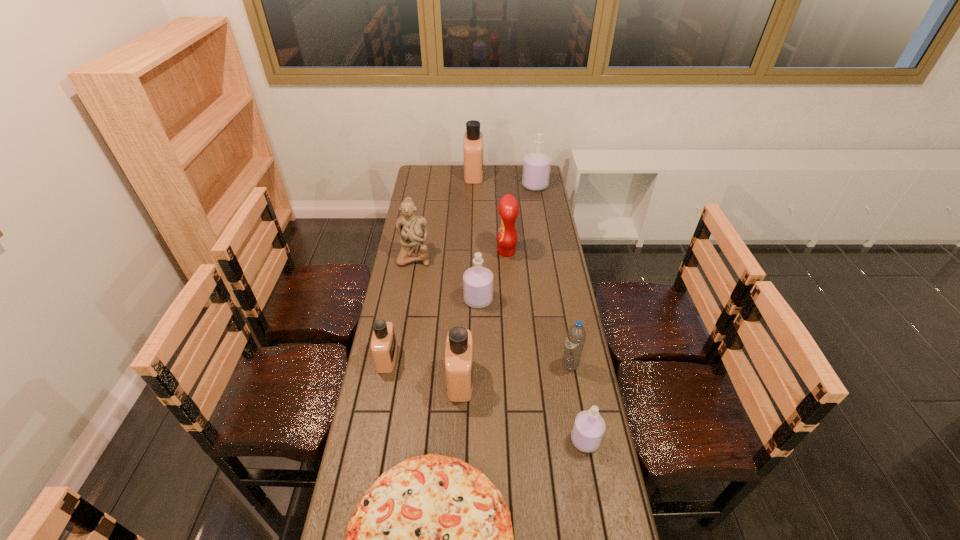
This screenshot has height=540, width=960. Identify the location of free space at the far left corner of the desktop. (420, 166).

Find the location of a particular element. This screenshot has height=540, width=960. vacant region at the far right corner of the desktop is located at coordinates (521, 184).

Locate an element on the screen. The height and width of the screenshot is (540, 960). unoccupied position between the nearest perfume and the farthest purple perfume is located at coordinates pyautogui.click(x=560, y=313).

Identify the location of free space between the water bottle and the second nearest object. This screenshot has height=540, width=960. (578, 402).

At what (x,y) coordinates should I click in order to perform the action: click on vacant space in between the water bottle and the condiment. Please return your answer as a coordinate pair (x, y). The width and height of the screenshot is (960, 540). Looking at the image, I should click on pos(539,308).

Image resolution: width=960 pixels, height=540 pixels. What are the coordinates of `free space between the blue water bottle and the red condiment` in the screenshot? It's located at (539, 308).

Identify the location of vacant point located between the smallest beige perfume and the blue water bottle. (478, 362).

Where is `free space between the second biggest beige perfume and the smallest purple perfume`? Image resolution: width=960 pixels, height=540 pixels. free space between the second biggest beige perfume and the smallest purple perfume is located at coordinates (523, 410).

Find the location of a particular element. The height and width of the screenshot is (540, 960). object that is the fourth closest to the leftmost beige perfume is located at coordinates (412, 230).

What are the coordinates of `the fifth closest object to the white figurine` in the screenshot? It's located at (473, 138).